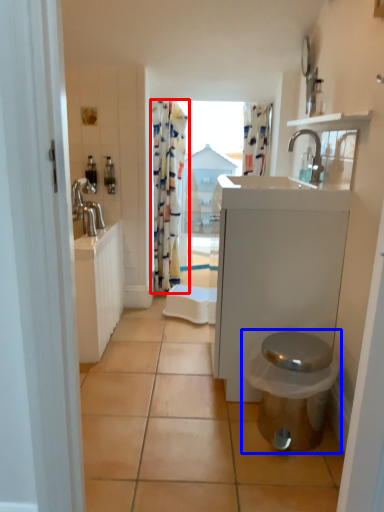
Question: Which object is further to the camera taking this photo, curtain (highlighted by a red box) or toilet (highlighted by a blue box)?

Choices:
 (A) curtain
 (B) toilet

Answer: (A)